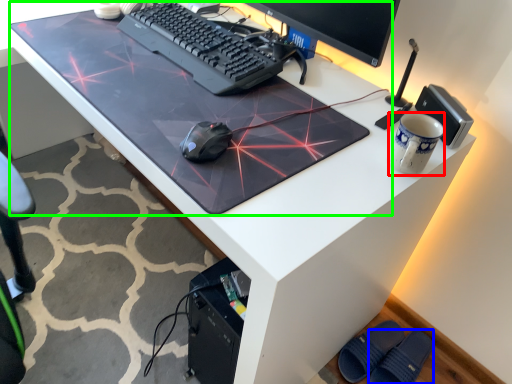
Question: Which object is the closest to the mug (highlighted by a red box)? Choose among these: slipper (highlighted by a blue box) or table top (highlighted by a green box).

Choices:
 (A) slipper
 (B) table top

Answer: (B)